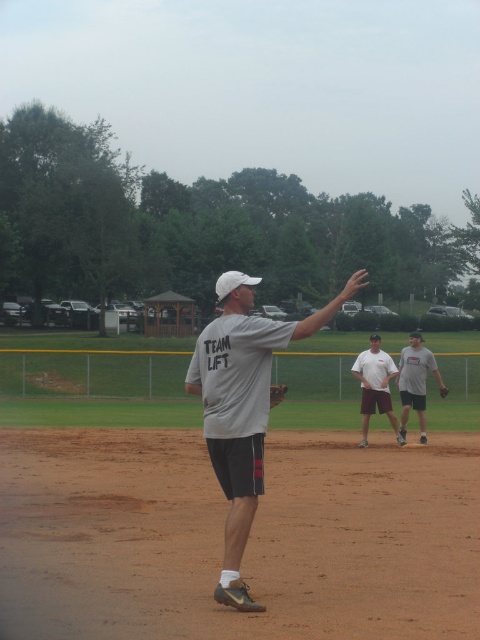
You are a photographer trying to capture a photo of the brown dirt field at center and the white cotton shirt at center. Which object should you zoom in on to make them appear larger in the photo?

The white cotton shirt at center is larger than the brown dirt field at center, so you should zoom in on the white cotton shirt at center to make it appear larger in the photo.